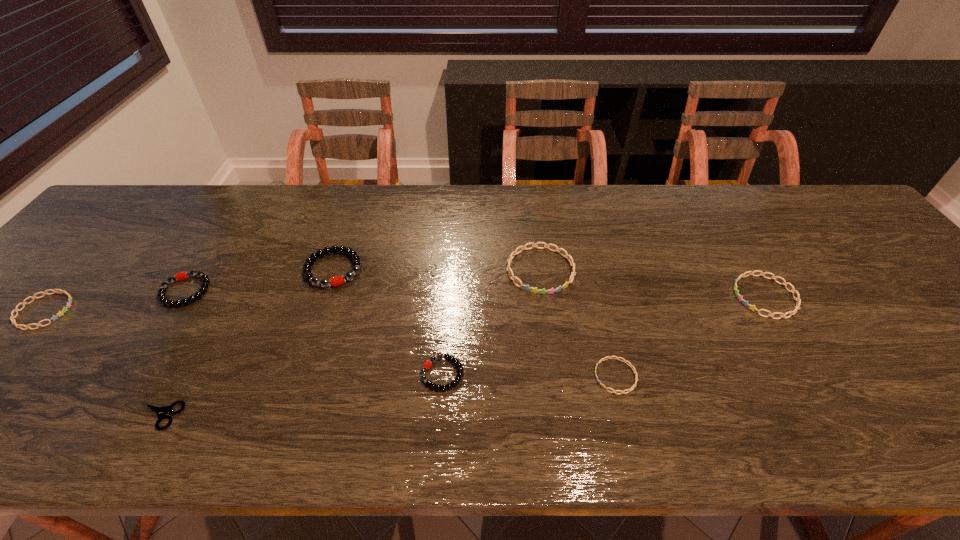
Identify the location of black bracelet that is the second closest to the leftmost black bracelet. (427, 365).

At what (x,y) coordinates should I click in order to perform the action: click on black bracelet that is the second nearest to the sixth bracelet from right to left. Please return your answer as a coordinate pair (x, y). Looking at the image, I should click on click(x=427, y=365).

Where is `vacant space that satisfies the following two spatial constraints: 1. on the surface of the rightmost blue bracelet showing star-shaped elements; 2. on the front side of the shortest object`? vacant space that satisfies the following two spatial constraints: 1. on the surface of the rightmost blue bracelet showing star-shaped elements; 2. on the front side of the shortest object is located at coordinates (836, 416).

Locate an element on the screen. Image resolution: width=960 pixels, height=540 pixels. vacant space that satisfies the following two spatial constraints: 1. on the front side of the shears; 2. on the left side of the second smallest black bracelet is located at coordinates (108, 416).